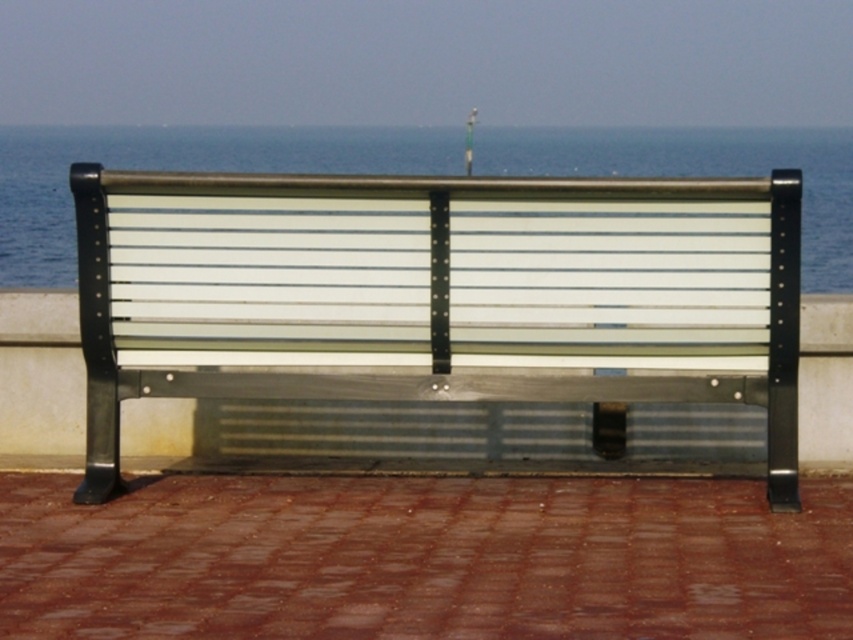
Does point (781, 248) lie in front of point (833, 212)?

Yes.

Is metallic silver bench at center closer to camera compared to transparent glass water at upper center?

No, it is behind transparent glass water at upper center.

This screenshot has height=640, width=853. What are the coordinates of `metallic silver bench at center` in the screenshot? It's located at (438, 294).